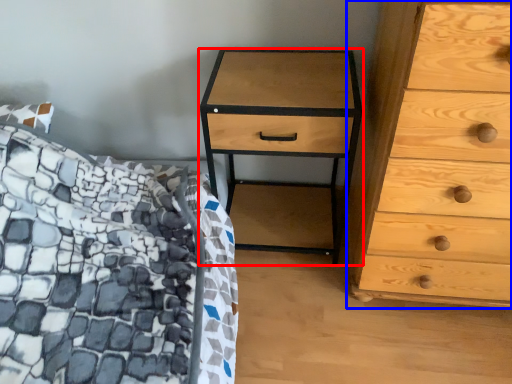
Question: Which point is further to the camera, nightstand (highlighted by a red box) or chest of drawers (highlighted by a blue box)?

Choices:
 (A) nightstand
 (B) chest of drawers

Answer: (A)